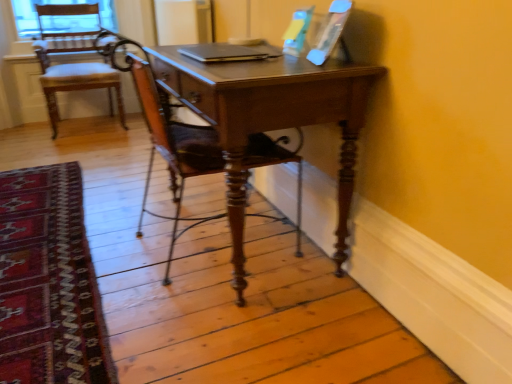
Find the location of `wooden polished chair at center, the 2th chair positioned from the left`. wooden polished chair at center, the 2th chair positioned from the left is located at coordinates (173, 149).

The height and width of the screenshot is (384, 512). Identify the location of carpet with intricate patterns at lower left. (49, 282).

Is there a large distance between wooden polished chair at center, the first chair in the front-to-back sequence, and wooden chair at left, marked as the second chair in a front-to-back arrangement?

Yes, wooden polished chair at center, the first chair in the front-to-back sequence, and wooden chair at left, marked as the second chair in a front-to-back arrangement, are quite far apart.

From their relative heights in the image, would you say wooden polished chair at center, the 2th chair positioned from the left, is taller or shorter than wooden chair at left, positioned as the 2th chair in right-to-left order?

wooden polished chair at center, the 2th chair positioned from the left, is shorter than wooden chair at left, positioned as the 2th chair in right-to-left order.

How many degrees apart are the facing directions of wooden polished chair at center, the first chair in the front-to-back sequence, and wooden chair at left, marked as the second chair in a front-to-back arrangement?

93 degrees separate the facing orientations of wooden polished chair at center, the first chair in the front-to-back sequence, and wooden chair at left, marked as the second chair in a front-to-back arrangement.

From the image's perspective, which is above, wooden polished chair at center, the first chair in the front-to-back sequence, or wooden chair at left, positioned as the 2th chair in right-to-left order?

wooden chair at left, positioned as the 2th chair in right-to-left order.

In the scene shown: Is wooden chair at left, the first chair from the back, beside silver metallic laptop at center?

They are not placed beside each other.

Based on the photo, in terms of width, does wooden chair at left, positioned as the 2th chair in right-to-left order, look wider or thinner when compared to silver metallic laptop at center?

Considering their sizes, wooden chair at left, positioned as the 2th chair in right-to-left order, looks broader than silver metallic laptop at center.

From a real-world perspective, is wooden chair at left, the 1th chair viewed from the left, below silver metallic laptop at center?

Yes, from a real-world perspective, wooden chair at left, the 1th chair viewed from the left, is beneath silver metallic laptop at center.

How different are the orientations of wooden chair at left, the 1th chair viewed from the left, and silver metallic laptop at center in degrees?

wooden chair at left, the 1th chair viewed from the left, and silver metallic laptop at center are facing 88.1 degrees away from each other.

From the picture: Is wooden chair at left, the first chair from the back, smaller than carpet with intricate patterns at lower left?

Incorrect, wooden chair at left, the first chair from the back, is not smaller in size than carpet with intricate patterns at lower left.

In the scene shown: Is wooden chair at left, positioned as the 2th chair in right-to-left order, spatially inside carpet with intricate patterns at lower left, or outside of it?

The correct answer is: outside.

From the image's perspective, between wooden chair at left, positioned as the 2th chair in right-to-left order, and carpet with intricate patterns at lower left, who is located below?

carpet with intricate patterns at lower left appears lower in the image.

Is silver metallic laptop at center beside wooden polished chair at center, the first chair in the front-to-back sequence?

silver metallic laptop at center is not next to wooden polished chair at center, the first chair in the front-to-back sequence, and they're not touching.

Can you confirm if silver metallic laptop at center is positioned to the left of wooden polished chair at center, which is the second chair from back to front?

Incorrect, silver metallic laptop at center is not on the left side of wooden polished chair at center, which is the second chair from back to front.

Considering the relative sizes of silver metallic laptop at center and wooden polished chair at center, which is the second chair from back to front, in the image provided, is silver metallic laptop at center smaller than wooden polished chair at center, which is the second chair from back to front,?

Correct, silver metallic laptop at center occupies less space than wooden polished chair at center, which is the second chair from back to front.

Between point (278, 55) and point (151, 124), which one is positioned behind?

Point (151, 124)

From the picture: Is wooden polished chair at center, the first chair viewed from the right, further to the viewer compared to carpet with intricate patterns at lower left?

A: Yes, it is.

Who is smaller, wooden polished chair at center, the 2th chair positioned from the left, or carpet with intricate patterns at lower left?

With smaller size is carpet with intricate patterns at lower left.

Can you tell me how much wooden polished chair at center, the first chair in the front-to-back sequence, and carpet with intricate patterns at lower left differ in facing direction?

wooden polished chair at center, the first chair in the front-to-back sequence, and carpet with intricate patterns at lower left are facing 91.4 degrees away from each other.

Is wooden polished chair at center, which is the second chair from back to front, thinner than carpet with intricate patterns at lower left?

Yes.

Is carpet with intricate patterns at lower left not near wooden polished chair at center, the 2th chair positioned from the left?

No, carpet with intricate patterns at lower left is not far away from wooden polished chair at center, the 2th chair positioned from the left.

From the image's perspective, which is below, carpet with intricate patterns at lower left or wooden polished chair at center, the first chair in the front-to-back sequence?

carpet with intricate patterns at lower left is shown below in the image.

Considering the sizes of objects carpet with intricate patterns at lower left and wooden polished chair at center, the 2th chair positioned from the left, in the image provided, who is smaller, carpet with intricate patterns at lower left or wooden polished chair at center, the 2th chair positioned from the left,?

Smaller between the two is carpet with intricate patterns at lower left.

In order to click on the 2nd chair positioned above the carpet with intricate patterns at lower left (from the image's perspective) in this screenshot , I will do `click(78, 68)`.

Is wooden chair at left, the 1th chair viewed from the left, a part of carpet with intricate patterns at lower left?

No, wooden chair at left, the 1th chair viewed from the left, is located outside of carpet with intricate patterns at lower left.

Would you consider carpet with intricate patterns at lower left to be distant from wooden chair at left, the 1th chair viewed from the left?

Absolutely, carpet with intricate patterns at lower left is distant from wooden chair at left, the 1th chair viewed from the left.

From the picture: Considering the sizes of objects carpet with intricate patterns at lower left and wooden chair at left, the first chair from the back, in the image provided, who is shorter, carpet with intricate patterns at lower left or wooden chair at left, the first chair from the back,?

Standing shorter between the two is carpet with intricate patterns at lower left.

You are a GUI agent. You are given a task and a screenshot of the screen. Output one action in this format:
    pyautogui.click(x=<x>, y=<y>)
    Task: Click on the chair that appears below the wooden chair at left, marked as the second chair in a front-to-back arrangement (from a real-world perspective)
    
    Given the screenshot: What is the action you would take?
    pyautogui.click(x=173, y=149)

I want to click on the 2nd chair to the left of the silver metallic laptop at center, starting your count from the anchor, so click(x=78, y=68).

Looking at this image, when comparing their distances from wooden polished chair at center, the first chair viewed from the right, does wooden chair at left, the 1th chair viewed from the left, or carpet with intricate patterns at lower left seem further?

Among the two, wooden chair at left, the 1th chair viewed from the left, is located further to wooden polished chair at center, the first chair viewed from the right.

Looking at the image, which one is located closer to carpet with intricate patterns at lower left, silver metallic laptop at center or wooden polished chair at center, the 2th chair positioned from the left?

Based on the image, wooden polished chair at center, the 2th chair positioned from the left, appears to be nearer to carpet with intricate patterns at lower left.

Which object lies further to the anchor point carpet with intricate patterns at lower left, wooden chair at left, positioned as the 2th chair in right-to-left order, or wooden polished chair at center, the first chair in the front-to-back sequence?

wooden chair at left, positioned as the 2th chair in right-to-left order, is positioned further to the anchor carpet with intricate patterns at lower left.

From the image, which object appears to be farther from wooden polished chair at center, which is the second chair from back to front, silver metallic laptop at center or wooden chair at left, marked as the second chair in a front-to-back arrangement?

Based on the image, wooden chair at left, marked as the second chair in a front-to-back arrangement, appears to be further to wooden polished chair at center, which is the second chair from back to front.

In the scene shown: From the image, which object appears to be farther from wooden chair at left, the first chair from the back, wooden polished chair at center, the 2th chair positioned from the left, or silver metallic laptop at center?

silver metallic laptop at center is further to wooden chair at left, the first chair from the back.

Estimate the real-world distances between objects in this image. Which object is further from wooden chair at left, the 1th chair viewed from the left, carpet with intricate patterns at lower left or silver metallic laptop at center?

The object further to wooden chair at left, the 1th chair viewed from the left, is silver metallic laptop at center.

Looking at the image, which one is located closer to wooden polished chair at center, which is the second chair from back to front, carpet with intricate patterns at lower left or silver metallic laptop at center?

silver metallic laptop at center is closer to wooden polished chair at center, which is the second chair from back to front.

When comparing their distances from carpet with intricate patterns at lower left, does wooden polished chair at center, which is the second chair from back to front, or wooden chair at left, the 1th chair viewed from the left, seem closer?

Based on the image, wooden polished chair at center, which is the second chair from back to front, appears to be nearer to carpet with intricate patterns at lower left.

The height and width of the screenshot is (384, 512). Find the location of `chair positioned between carpet with intricate patterns at lower left and wooden chair at left, the 1th chair viewed from the left, from near to far`. chair positioned between carpet with intricate patterns at lower left and wooden chair at left, the 1th chair viewed from the left, from near to far is located at coordinates (173, 149).

You are a GUI agent. You are given a task and a screenshot of the screen. Output one action in this format:
    pyautogui.click(x=<x>, y=<y>)
    Task: Click on the laptop between carpet with intricate patterns at lower left and wooden chair at left, positioned as the 2th chair in right-to-left order, in the front-back direction
    
    Given the screenshot: What is the action you would take?
    pyautogui.click(x=227, y=53)

The image size is (512, 384). What are the coordinates of `laptop located between wooden polished chair at center, the first chair in the front-to-back sequence, and wooden chair at left, the first chair from the back, in the depth direction` in the screenshot? It's located at (227, 53).

Locate an element on the screen. The height and width of the screenshot is (384, 512). chair located between carpet with intricate patterns at lower left and silver metallic laptop at center in the left-right direction is located at coordinates (173, 149).